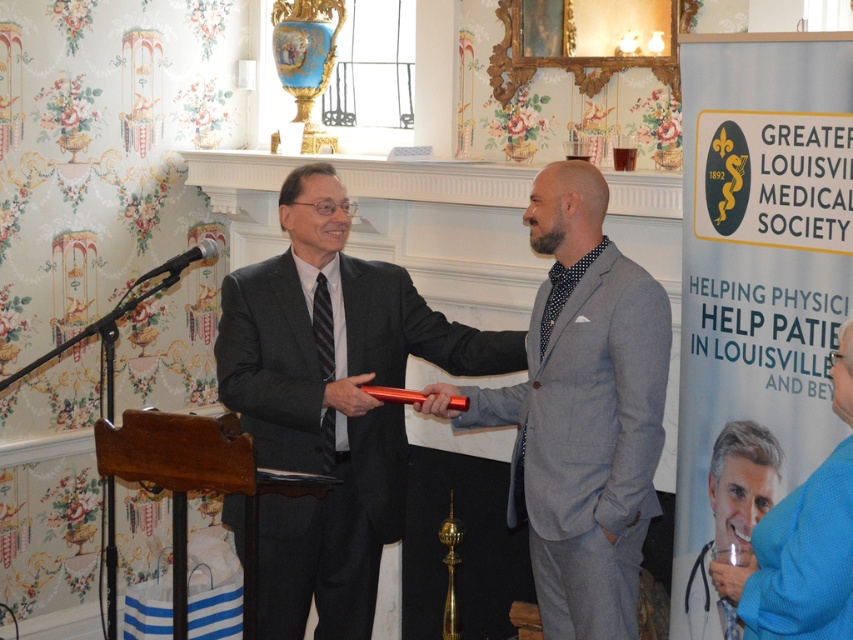
Question: Which point is farther from the camera taking this photo?

Choices:
 (A) (350, 540)
 (B) (561, 284)
 (C) (171, 272)

Answer: (A)

Question: Considering the relative positions of matte black suit at center and gray wool suit at center in the image provided, where is matte black suit at center located with respect to gray wool suit at center?

Choices:
 (A) right
 (B) left

Answer: (B)

Question: Estimate the real-world distances between objects in this image. Which object is closer to the blue fabric shirt at lower right?

Choices:
 (A) matte black suit at center
 (B) gray wool suit at center

Answer: (B)

Question: Is blue fabric shirt at lower right thinner than metallic silver microphone at left?

Choices:
 (A) no
 (B) yes

Answer: (B)

Question: Does gray wool suit at center have a lesser width compared to metallic silver microphone at left?

Choices:
 (A) yes
 (B) no

Answer: (B)

Question: Which point is closer to the camera?

Choices:
 (A) (329, 609)
 (B) (821, 600)
 (C) (190, 257)
 (D) (564, 506)

Answer: (B)